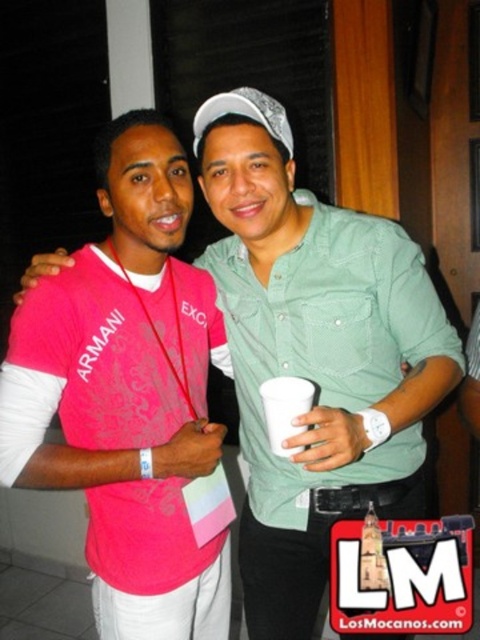
You are a photographer trying to capture a clear shot of both the pink fabric shirt at center and the white paper cup at center. Based on their positions, which object is closer to the camera?

The pink fabric shirt at center is positioned under the white paper cup at center, meaning the cup is closer to the camera since it appears above the shirt in the image.